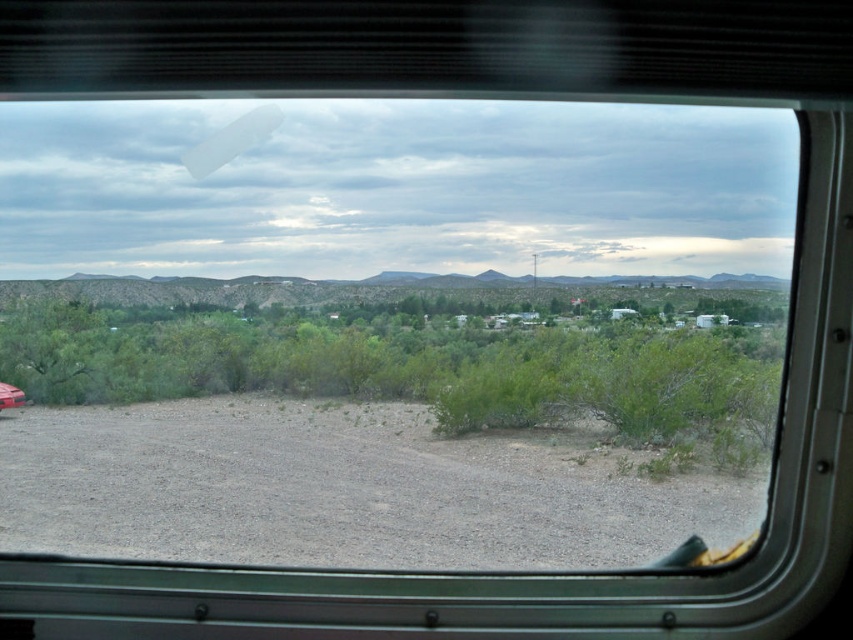
Which is in front, point (230, 440) or point (20, 397)?

Point (230, 440) is in front.

Who is lower down, gray gravel dirt track at lower left or matte red car at lower left?

gray gravel dirt track at lower left is below.

I want to click on gray gravel dirt track at lower left, so click(340, 490).